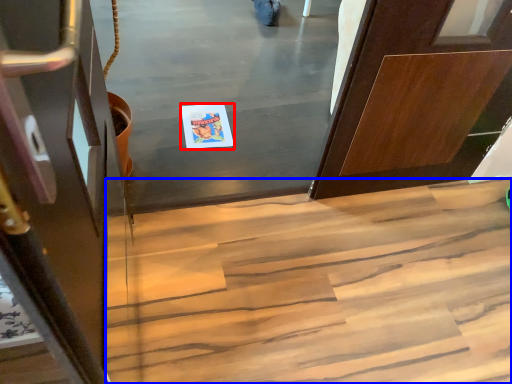
Question: Which point is further to the camera, postcard (highlighted by a red box) or stairs (highlighted by a blue box)?

Choices:
 (A) postcard
 (B) stairs

Answer: (A)